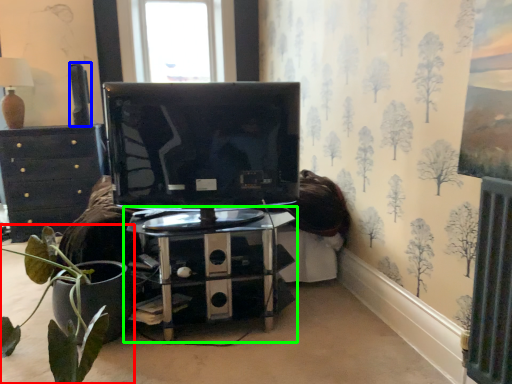
Question: Which object is the farthest from houseplant (highlighted by a red box)? Choose among these: speaker (highlighted by a blue box) or table (highlighted by a green box).

Choices:
 (A) speaker
 (B) table

Answer: (A)